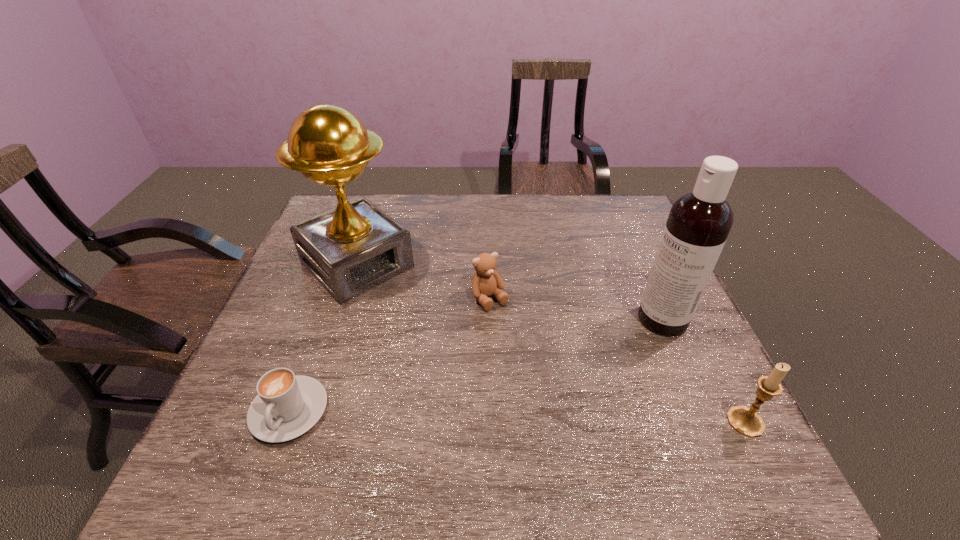
This screenshot has width=960, height=540. What are the coordinates of `cappuccino` in the screenshot? It's located at (287, 405).

Find the location of a particular element. the third shortest object is located at coordinates (746, 421).

Identify the location of award. The width and height of the screenshot is (960, 540). (355, 247).

Find the location of a particular element. the fourth tallest object is located at coordinates (486, 281).

The image size is (960, 540). In order to click on the third object from right to left in this screenshot , I will do `click(486, 281)`.

Find the location of a particular element. The width and height of the screenshot is (960, 540). dishwasher detergent is located at coordinates (699, 222).

Locate an element on the screen. Image resolution: width=960 pixels, height=540 pixels. vacant space located on the left of the third shortest object is located at coordinates (556, 422).

This screenshot has height=540, width=960. I want to click on free location located on the front-facing side of the award, so click(490, 389).

Where is `vacant space located 0.250m on the front-facing side of the award`? vacant space located 0.250m on the front-facing side of the award is located at coordinates (448, 350).

Image resolution: width=960 pixels, height=540 pixels. In order to click on vacant area situated 0.130m on the front-facing side of the award in this screenshot , I will do pos(418,321).